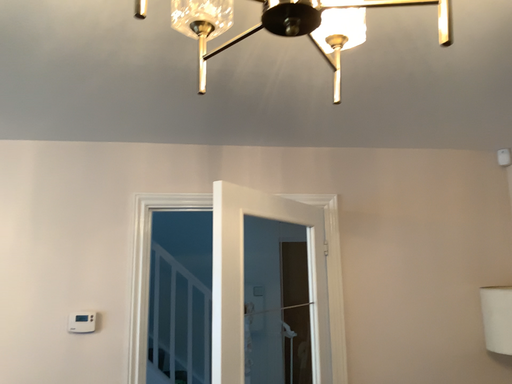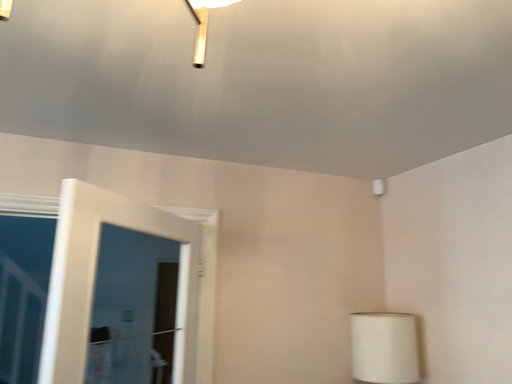
Question: How did the camera likely rotate when shooting the video?

Choices:
 (A) rotated right
 (B) rotated left

Answer: (A)